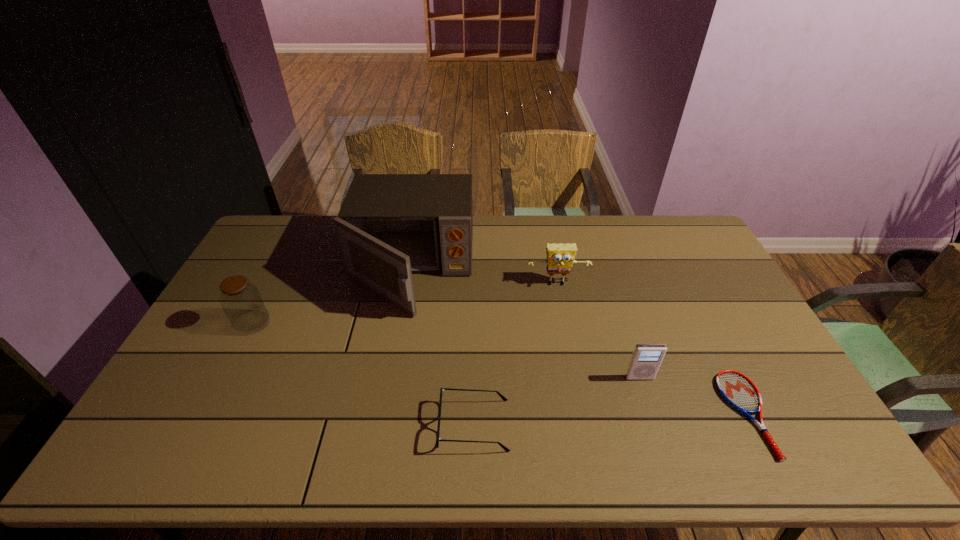
Locate an element on the screen. This screenshot has height=540, width=960. unoccupied area between the iPod and the second shortest object is located at coordinates (557, 401).

Find the location of a particular element. Image resolution: width=960 pixels, height=540 pixels. vacant point located between the tallest object and the jar is located at coordinates (331, 296).

Point out which object is positioned as the fifth nearest to the spectacles. Please provide its 2D coordinates. Your answer should be formatted as a tuple, i.e. [(x, y)], where the tuple contains the x and y coordinates of a point satisfying the conditions above.

[(241, 301)]

Where is `the fifth closest object to the leftmost object`? Image resolution: width=960 pixels, height=540 pixels. the fifth closest object to the leftmost object is located at coordinates 736,389.

Identify the location of vacant region that satisfies the following two spatial constraints: 1. on the face of the rightmost object; 2. on the right side of the fourth object from left to right. (582, 414).

At what (x,y) coordinates should I click in order to perform the action: click on blank area in the image that satisfies the following two spatial constraints: 1. on the front side of the shortest object; 2. on the right side of the jar. Please return your answer as a coordinate pair (x, y). The width and height of the screenshot is (960, 540). Looking at the image, I should click on (205, 414).

Locate an element on the screen. free space in the image that satisfies the following two spatial constraints: 1. on the face of the fourth object from left to right; 2. with the lenses facing outward on the fifth tallest object is located at coordinates (584, 425).

Identify the location of vacant space that satisfies the following two spatial constraints: 1. with the door open on the front of the microwave oven; 2. on the left side of the rightmost object. (386, 414).